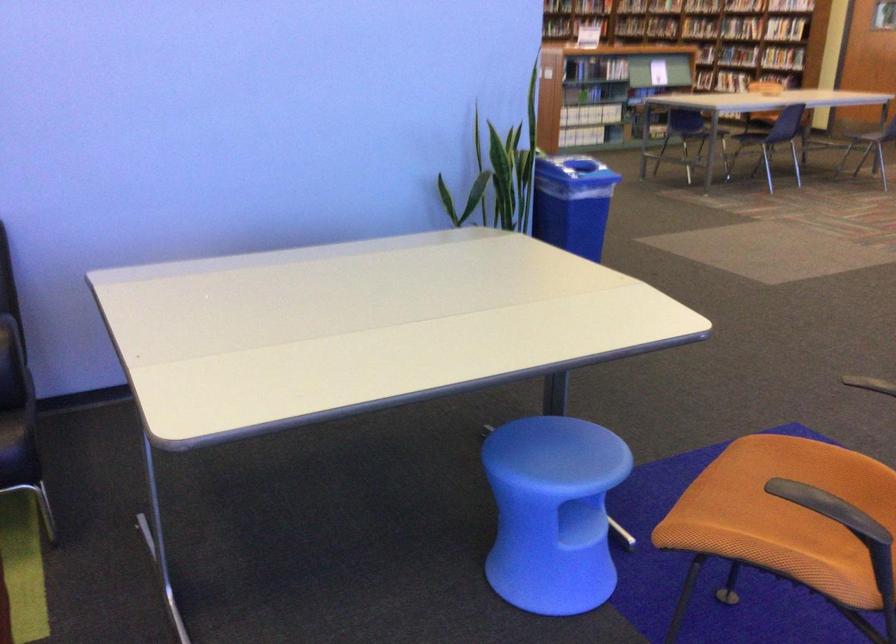
This screenshot has width=896, height=644. What do you see at coordinates (560, 453) in the screenshot?
I see `the blue chair sitting surface` at bounding box center [560, 453].